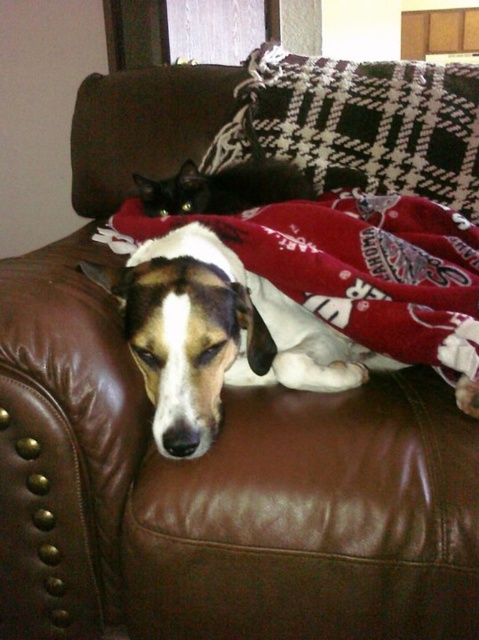
Consider the image. Can you confirm if red fleece blanket at center is positioned to the right of plaid fabric pillow at upper center?

Incorrect, red fleece blanket at center is not on the right side of plaid fabric pillow at upper center.

Is red fleece blanket at center closer to the viewer compared to plaid fabric pillow at upper center?

Yes, red fleece blanket at center is in front of plaid fabric pillow at upper center.

Does point (355, 212) lie behind point (408, 168)?

No, (355, 212) is closer to viewer.

This screenshot has height=640, width=479. I want to click on red fleece blanket at center, so click(354, 268).